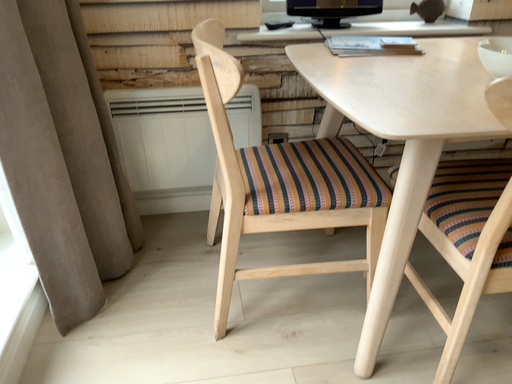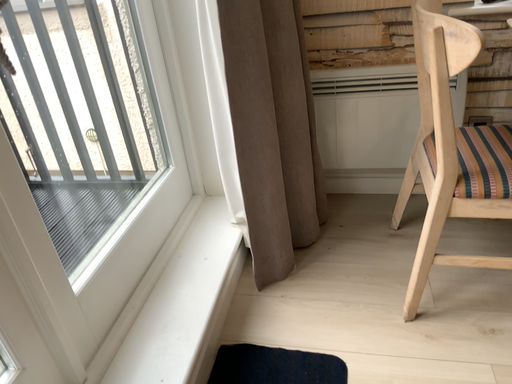
Question: Which way did the camera rotate in the video?

Choices:
 (A) rotated right
 (B) rotated left

Answer: (B)